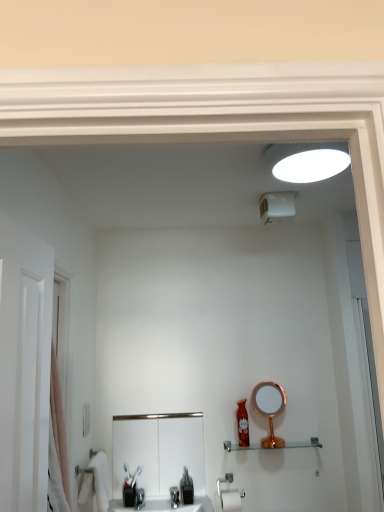
Question: Is satin nickel sink at center to the left of white soft towel at lower left from the viewer's perspective?

Choices:
 (A) yes
 (B) no

Answer: (B)

Question: Does satin nickel sink at center come in front of white soft towel at lower left?

Choices:
 (A) yes
 (B) no

Answer: (B)

Question: Is satin nickel sink at center beside white soft towel at lower left?

Choices:
 (A) no
 (B) yes

Answer: (A)

Question: From a real-world perspective, is satin nickel sink at center located higher than white soft towel at lower left?

Choices:
 (A) no
 (B) yes

Answer: (B)

Question: From the image's perspective, is satin nickel sink at center below white soft towel at lower left?

Choices:
 (A) no
 (B) yes

Answer: (A)

Question: Is satin nickel sink at center not within white soft towel at lower left?

Choices:
 (A) yes
 (B) no

Answer: (A)

Question: Could you tell me if matte red bottle at center is facing pink fabric shower curtain at left?

Choices:
 (A) no
 (B) yes

Answer: (A)

Question: Does matte red bottle at center have a lesser height compared to pink fabric shower curtain at left?

Choices:
 (A) yes
 (B) no

Answer: (A)

Question: Does matte red bottle at center have a greater width compared to pink fabric shower curtain at left?

Choices:
 (A) no
 (B) yes

Answer: (A)

Question: Is pink fabric shower curtain at left at the back of matte red bottle at center?

Choices:
 (A) yes
 (B) no

Answer: (B)

Question: Considering the relative sizes of matte red bottle at center and pink fabric shower curtain at left in the image provided, is matte red bottle at center taller than pink fabric shower curtain at left?

Choices:
 (A) yes
 (B) no

Answer: (B)

Question: Is there a large distance between matte red bottle at center and pink fabric shower curtain at left?

Choices:
 (A) yes
 (B) no

Answer: (A)

Question: Is the position of black plastic soap dispenser at lower center less distant than that of matte red bottle at center?

Choices:
 (A) no
 (B) yes

Answer: (B)